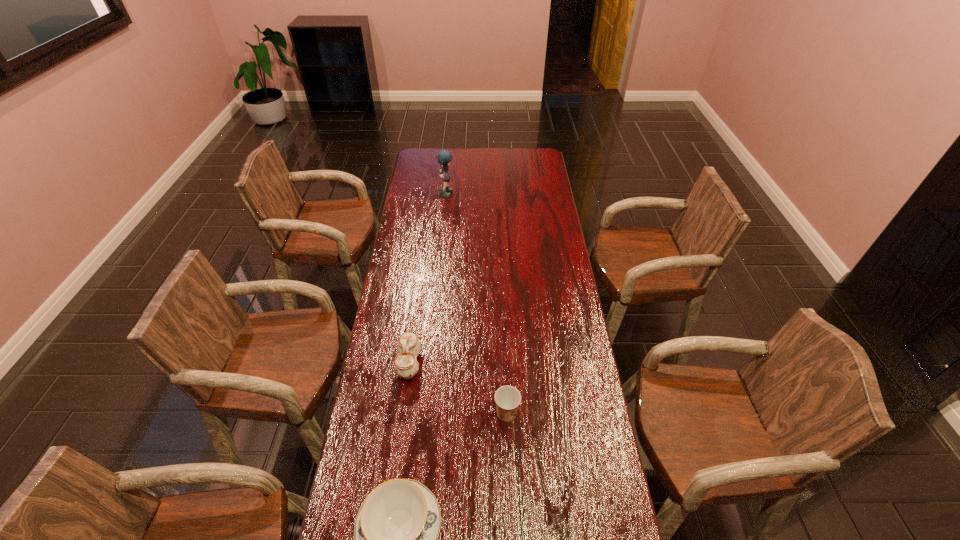
Identify the location of the farthest object. The width and height of the screenshot is (960, 540). (444, 157).

The image size is (960, 540). What are the coordinates of `the tallest object` in the screenshot? It's located at (444, 157).

I want to click on the farther chinaware, so click(406, 365).

Locate an element on the screen. The height and width of the screenshot is (540, 960). the rightmost object is located at coordinates (507, 398).

This screenshot has width=960, height=540. In order to click on Dixie cup in this screenshot , I will do point(507,398).

The height and width of the screenshot is (540, 960). In order to click on free point located on the front-facing side of the rag doll in this screenshot , I will do `click(504, 192)`.

Find the location of a particular element. free location located by the handle of the third nearest object is located at coordinates click(x=468, y=363).

Identify the location of free space located 0.210m on the right of the Dixie cup. The image size is (960, 540). (587, 413).

I want to click on rag doll positioned at the left edge, so click(x=444, y=157).

At what (x,y) coordinates should I click in order to perform the action: click on chinaware positioned at the left edge. Please return your answer as a coordinate pair (x, y). This screenshot has width=960, height=540. Looking at the image, I should click on (406, 365).